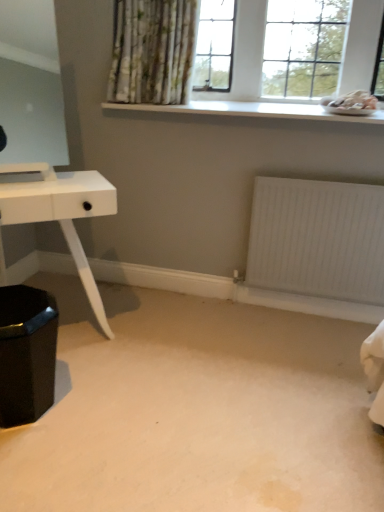
Question: From the image's perspective, does white textured radiator at lower right appear lower than shiny black hexagonal stool at lower left?

Choices:
 (A) no
 (B) yes

Answer: (A)

Question: Is the position of white textured radiator at lower right more distant than that of shiny black hexagonal stool at lower left?

Choices:
 (A) yes
 (B) no

Answer: (A)

Question: Is shiny black hexagonal stool at lower left a part of white textured radiator at lower right?

Choices:
 (A) no
 (B) yes

Answer: (A)

Question: Is white textured radiator at lower right looking in the opposite direction of shiny black hexagonal stool at lower left?

Choices:
 (A) no
 (B) yes

Answer: (A)

Question: Is white textured radiator at lower right wider than shiny black hexagonal stool at lower left?

Choices:
 (A) yes
 (B) no

Answer: (B)

Question: From the image's perspective, is shiny black hexagonal stool at lower left above or below white wooden window at upper center?

Choices:
 (A) above
 (B) below

Answer: (B)

Question: Looking at the image, does shiny black hexagonal stool at lower left seem bigger or smaller compared to white wooden window at upper center?

Choices:
 (A) big
 (B) small

Answer: (B)

Question: Looking at their shapes, would you say shiny black hexagonal stool at lower left is wider or thinner than white wooden window at upper center?

Choices:
 (A) thin
 (B) wide

Answer: (B)

Question: Considering the positions of shiny black hexagonal stool at lower left and white wooden window at upper center in the image, is shiny black hexagonal stool at lower left taller or shorter than white wooden window at upper center?

Choices:
 (A) short
 (B) tall

Answer: (A)

Question: Based on their sizes in the image, would you say white wooden window at upper center is bigger or smaller than shiny black hexagonal stool at lower left?

Choices:
 (A) big
 (B) small

Answer: (A)

Question: Considering the positions of white wooden window at upper center and shiny black hexagonal stool at lower left in the image, is white wooden window at upper center taller or shorter than shiny black hexagonal stool at lower left?

Choices:
 (A) tall
 (B) short

Answer: (A)

Question: In terms of width, does white wooden window at upper center look wider or thinner when compared to shiny black hexagonal stool at lower left?

Choices:
 (A) wide
 (B) thin

Answer: (B)

Question: From a real-world perspective, relative to shiny black hexagonal stool at lower left, is white wooden window at upper center vertically above or below?

Choices:
 (A) above
 (B) below

Answer: (A)

Question: In terms of width, does white smooth window sill at upper center look wider or thinner when compared to white textured radiator at lower right?

Choices:
 (A) thin
 (B) wide

Answer: (B)

Question: From the image's perspective, is white smooth window sill at upper center located above or below white textured radiator at lower right?

Choices:
 (A) above
 (B) below

Answer: (A)